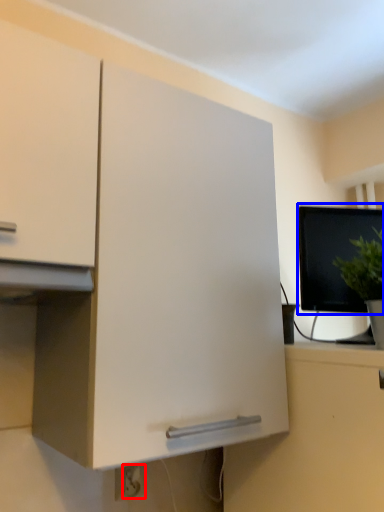
Question: Which point is closer to the camera, electric outlet (highlighted by a red box) or computer monitor (highlighted by a blue box)?

Choices:
 (A) electric outlet
 (B) computer monitor

Answer: (A)